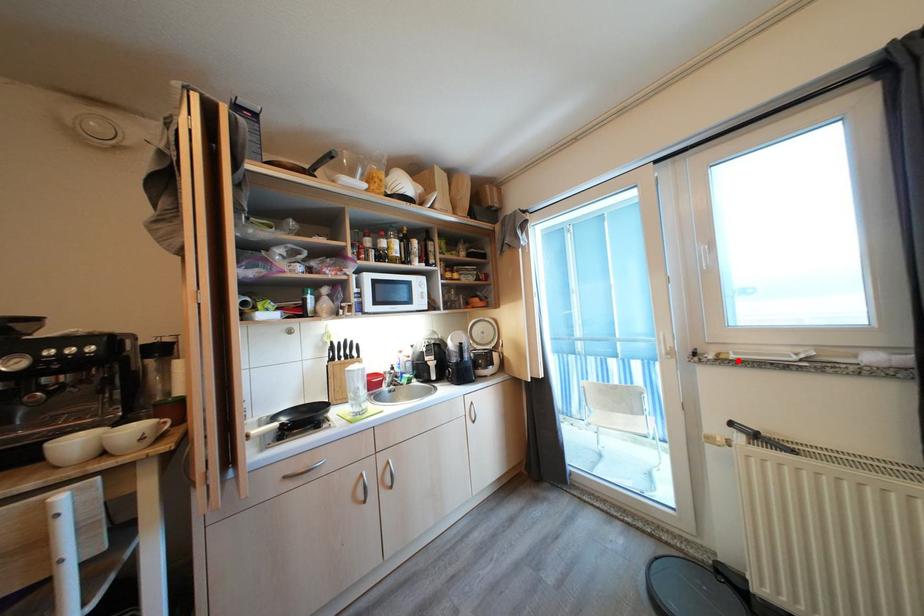
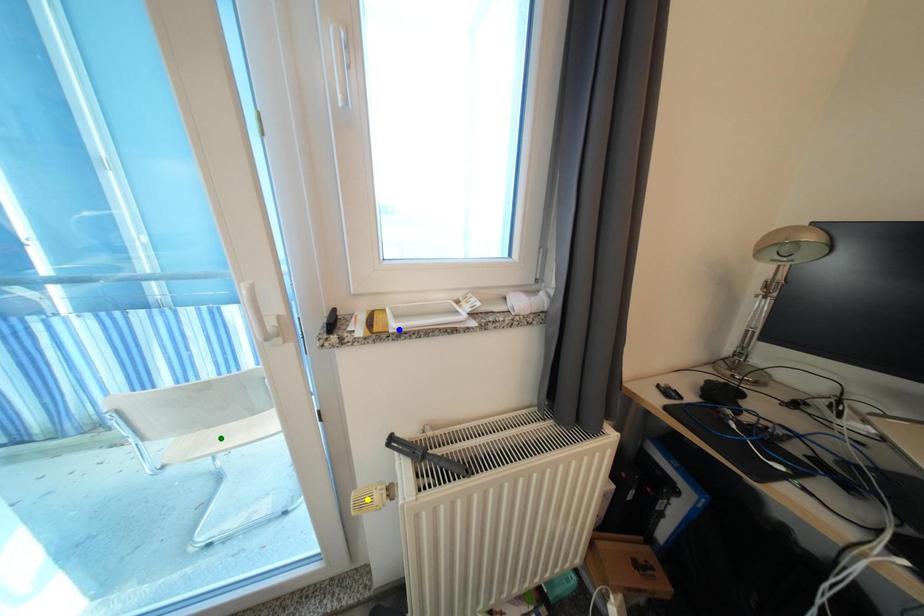
Question: I am providing you with two images of the same scene from different viewpoints. A red point is marked on the first image. You are given multiple points on the second image. In image 2, which mark is for the same physical point as the one in image 1?

Choices:
 (A) blue point
 (B) green point
 (C) yellow point

Answer: (A)